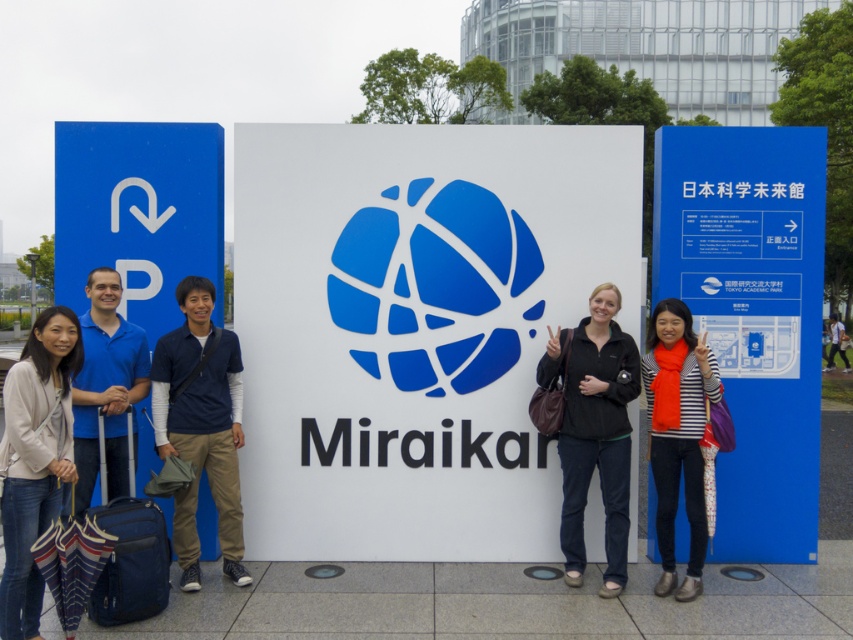
Question: Which object is the closest to the blue cotton shirt at center?

Choices:
 (A) black matte jacket at center
 (B) blue plastic sign at right
 (C) light beige sweater at center

Answer: (C)

Question: Observing the image, what is the correct spatial positioning of blue plastic sign at right in reference to blue fabric shirt at center?

Choices:
 (A) right
 (B) left

Answer: (A)

Question: Observing the image, what is the correct spatial positioning of blue cotton shirt at center in reference to black fabric jacket at center?

Choices:
 (A) left
 (B) right

Answer: (A)

Question: Which point is closer to the camera?

Choices:
 (A) (451, 428)
 (B) (833, 316)
 (C) (695, 477)
 (D) (537, 365)

Answer: (C)

Question: Which of the following is the closest to the observer?

Choices:
 (A) blue fabric shirt at center
 (B) blue cotton shirt at center

Answer: (A)

Question: Is blue plastic sign at left bigger than black fabric jacket at center?

Choices:
 (A) yes
 (B) no

Answer: (B)